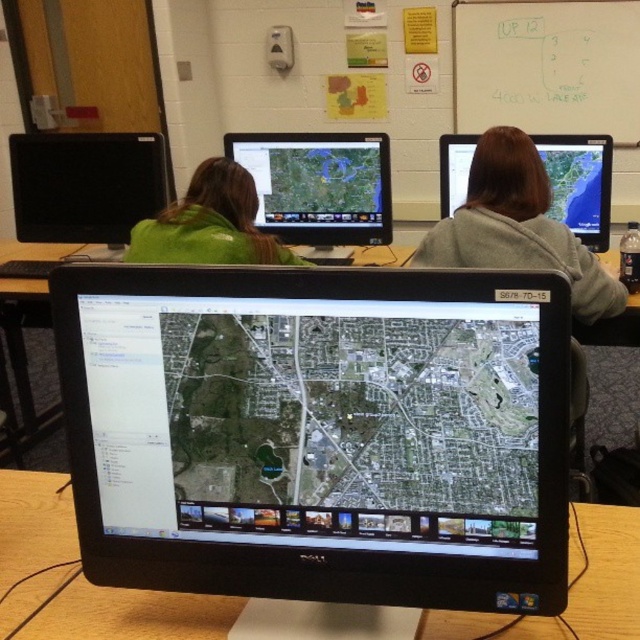
Is point (588, 577) closer to viewer compared to point (600, 148)?

That is True.

Measure the distance between wooden table at center and matte black monitor at upper right.

wooden table at center is 6.39 feet from matte black monitor at upper right.

Describe the element at coordinates (131, 614) in the screenshot. I see `wooden table at center` at that location.

Find the location of a particular element. The height and width of the screenshot is (640, 640). wooden table at center is located at coordinates (131, 614).

Does wooden table at center have a smaller size compared to green matte jacket at upper left?

Correct, wooden table at center occupies less space than green matte jacket at upper left.

Find the location of `wooden table at center`. wooden table at center is located at coordinates (131, 614).

Between black glossy monitor at center and matte black monitor at center, which one appears on the left side from the viewer's perspective?

matte black monitor at center is more to the left.

Who is more forward, [429,397] or [355,196]?

Point [429,397] is more forward.

The height and width of the screenshot is (640, 640). In order to click on black glossy monitor at center in this screenshot , I will do `click(320, 433)`.